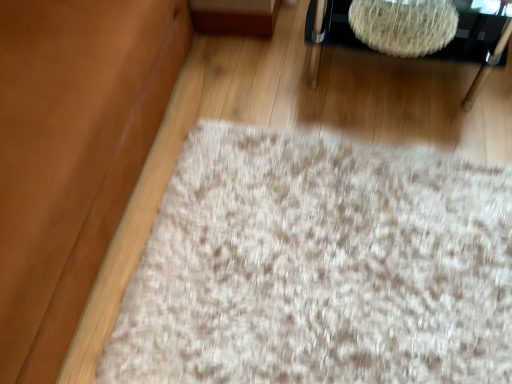
Locate an element on the screen. The image size is (512, 384). white textured rug at upper right is located at coordinates (477, 43).

Image resolution: width=512 pixels, height=384 pixels. What do you see at coordinates (477, 43) in the screenshot?
I see `white textured rug at upper right` at bounding box center [477, 43].

What do you see at coordinates (72, 154) in the screenshot?
I see `suede-like brown couch at lower left` at bounding box center [72, 154].

Where is `suede-like brown couch at lower left`? The image size is (512, 384). suede-like brown couch at lower left is located at coordinates [x=72, y=154].

At what (x,y) coordinates should I click in order to perform the action: click on white textured rug at upper right. Please return your answer as a coordinate pair (x, y). The image size is (512, 384). Looking at the image, I should click on tap(477, 43).

Considering the positions of objects suede-like brown couch at lower left and white textured rug at upper right in the image provided, who is more to the right, suede-like brown couch at lower left or white textured rug at upper right?

Positioned to the right is white textured rug at upper right.

Does suede-like brown couch at lower left lie behind white textured rug at upper right?

No, it is not.

Between point (88, 112) and point (313, 61), which one is positioned behind?

Point (313, 61)

Looking at this image, from the image's perspective, who appears lower, suede-like brown couch at lower left or white textured rug at upper right?

suede-like brown couch at lower left is shown below in the image.

From a real-world perspective, which object stands above the other?

From a 3D spatial view, suede-like brown couch at lower left is above.

Between suede-like brown couch at lower left and white textured rug at upper right, which one has smaller width?

With smaller width is white textured rug at upper right.

In terms of height, does suede-like brown couch at lower left look taller or shorter compared to white textured rug at upper right?

Considering their sizes, suede-like brown couch at lower left has more height than white textured rug at upper right.

Does suede-like brown couch at lower left have a smaller size compared to white textured rug at upper right?

Incorrect, suede-like brown couch at lower left is not smaller in size than white textured rug at upper right.

Would you say suede-like brown couch at lower left is outside white textured rug at upper right?

suede-like brown couch at lower left lies outside white textured rug at upper right's area.

Are suede-like brown couch at lower left and white textured rug at upper right beside each other?

No, suede-like brown couch at lower left is not making contact with white textured rug at upper right.

Is white textured rug at upper right at the back of suede-like brown couch at lower left?

No, white textured rug at upper right is not at the back of suede-like brown couch at lower left.

How distant is suede-like brown couch at lower left from white textured rug at upper right?

4.48 feet.

You are a GUI agent. You are given a task and a screenshot of the screen. Output one action in this format:
    pyautogui.click(x=<x>, y=<y>)
    Task: Click on the furniture that is behind the suede-like brown couch at lower left
    This screenshot has height=384, width=512.
    Given the screenshot: What is the action you would take?
    pyautogui.click(x=477, y=43)

Which is more to the left, white textured rug at upper right or suede-like brown couch at lower left?

suede-like brown couch at lower left is more to the left.

Considering their positions, is white textured rug at upper right located in front of or behind suede-like brown couch at lower left?

white textured rug at upper right is positioned farther from the viewer than suede-like brown couch at lower left.

Does point (464, 60) come farther from viewer compared to point (76, 78)?

Yes, point (464, 60) is farther from viewer.

From the image's perspective, between white textured rug at upper right and suede-like brown couch at lower left, which one is located above?

white textured rug at upper right is shown above in the image.

From a real-world perspective, is white textured rug at upper right located beneath suede-like brown couch at lower left?

Yes.

Looking at their sizes, would you say white textured rug at upper right is wider or thinner than suede-like brown couch at lower left?

In the image, white textured rug at upper right appears to be more narrow than suede-like brown couch at lower left.

Considering the relative sizes of white textured rug at upper right and suede-like brown couch at lower left in the image provided, is white textured rug at upper right taller than suede-like brown couch at lower left?

Incorrect, the height of white textured rug at upper right is not larger of that of suede-like brown couch at lower left.

Is white textured rug at upper right bigger or smaller than suede-like brown couch at lower left?

Considering their sizes, white textured rug at upper right takes up less space than suede-like brown couch at lower left.

Is suede-like brown couch at lower left completely or partially inside white textured rug at upper right?

No, suede-like brown couch at lower left is located outside of white textured rug at upper right.

Are white textured rug at upper right and suede-like brown couch at lower left beside each other?

No, white textured rug at upper right is not with suede-like brown couch at lower left.

Is white textured rug at upper right aimed at suede-like brown couch at lower left?

No, white textured rug at upper right is not facing towards suede-like brown couch at lower left.

Measure the distance between white textured rug at upper right and suede-like brown couch at lower left.

1.37 meters.

Where is `couch above the white textured rug at upper right (from a real-world perspective)`? couch above the white textured rug at upper right (from a real-world perspective) is located at coordinates tap(72, 154).

Find the location of a particular element. The width and height of the screenshot is (512, 384). furniture behind the suede-like brown couch at lower left is located at coordinates (477, 43).

Identify the location of couch in front of the white textured rug at upper right. The height and width of the screenshot is (384, 512). (72, 154).